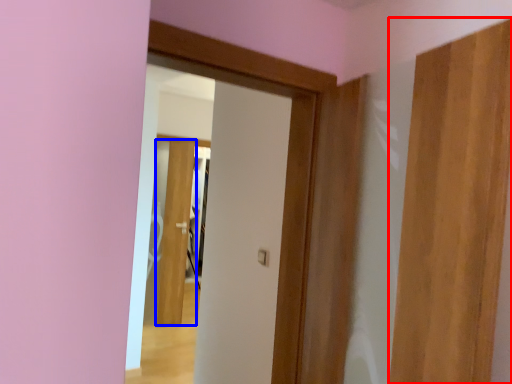
Question: Among these objects, which one is nearest to the camera, door (highlighted by a red box) or door (highlighted by a blue box)?

Choices:
 (A) door
 (B) door

Answer: (A)